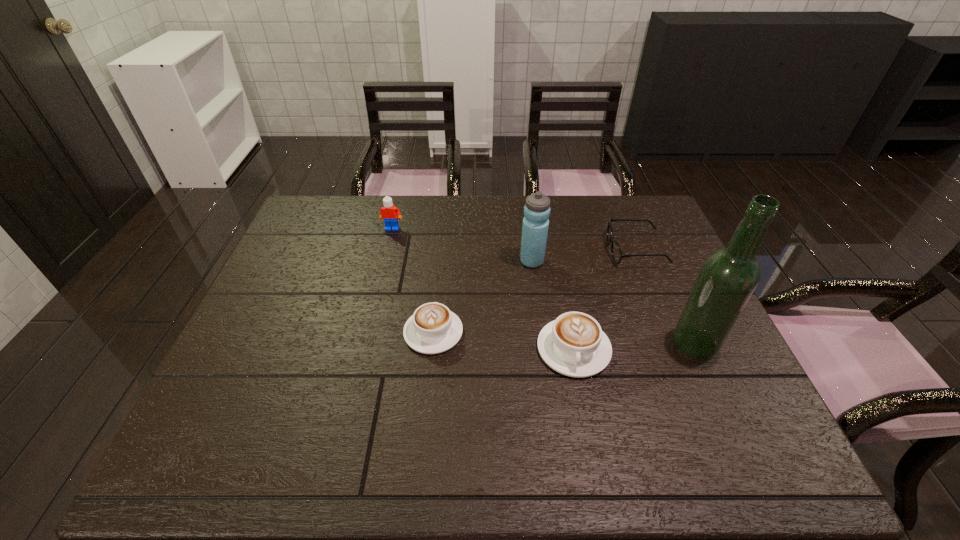
Locate an element on the screen. vacant space that's between the spectacles and the tallest object is located at coordinates (665, 296).

The image size is (960, 540). Identify the location of empty space between the spectacles and the fifth shortest object. (584, 255).

Where is `blank region between the spectacles and the water bottle`? Image resolution: width=960 pixels, height=540 pixels. blank region between the spectacles and the water bottle is located at coordinates (584, 255).

The image size is (960, 540). I want to click on empty space that is in between the spectacles and the taller cappuccino, so click(x=605, y=299).

You are a GUI agent. You are given a task and a screenshot of the screen. Output one action in this format:
    pyautogui.click(x=<x>, y=<y>)
    Task: Click on the vacant space that's between the water bottle and the spectacles
    The image size is (960, 540).
    Given the screenshot: What is the action you would take?
    pyautogui.click(x=584, y=255)

Find the location of a particular element. This screenshot has width=960, height=540. free space between the tallest object and the fourth tallest object is located at coordinates (635, 346).

Identify the location of unoccupied position between the right cappuccino and the leftmost object. The image size is (960, 540). (483, 288).

The width and height of the screenshot is (960, 540). I want to click on object that is the fifth closest one to the farthest object, so click(728, 277).

Locate which object ranks fourth in proximity to the farthest object. Please provide its 2D coordinates. Your answer should be formatted as a tuple, i.e. [(x, y)], where the tuple contains the x and y coordinates of a point satisfying the conditions above.

[(616, 252)]

You are a GUI agent. You are given a task and a screenshot of the screen. Output one action in this format:
    pyautogui.click(x=<x>, y=<y>)
    Task: Click on the blank area in the image that satisfies the following two spatial constraints: 1. on the face of the liquor; 2. on the right side of the Lego
    
    Given the screenshot: What is the action you would take?
    [x=365, y=343]